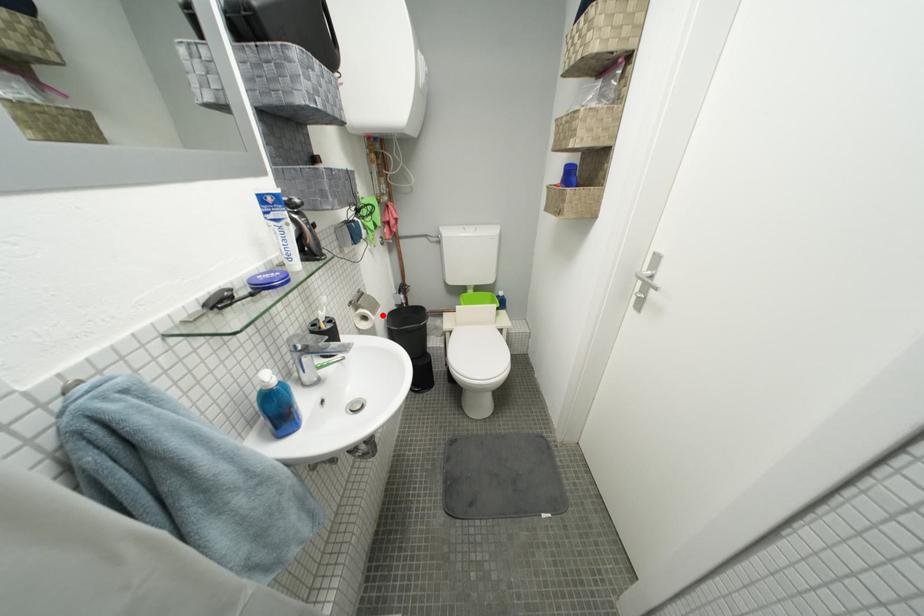
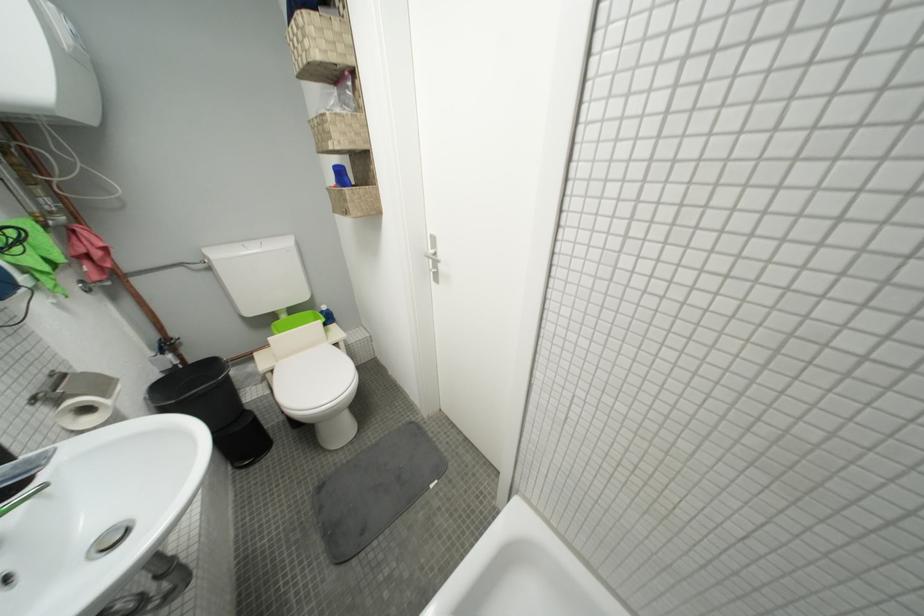
Find the pixel in the second image that matches the highlighted location in the first image.

(113, 397)